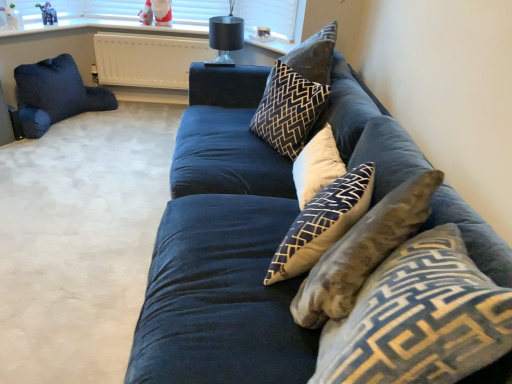
The image size is (512, 384). I want to click on free point below matte plastic santa at upper center, the third toy from the front (from a real-world perspective), so click(158, 24).